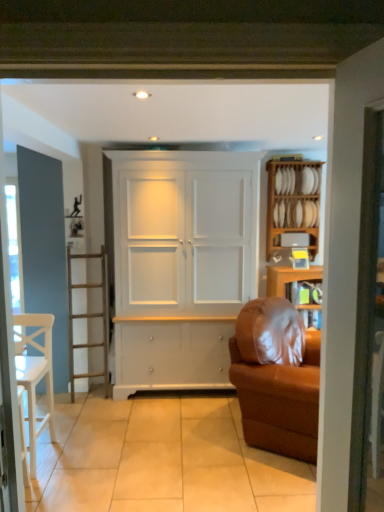
Looking at this image, in order to face white matte cabinet at center, should I rotate leftwards or rightwards?

Turn left by 0.757 degrees to look at white matte cabinet at center.

What are the coordinates of `white wooden shelf at upper right, the first shelf when ordered from bottom to top` in the screenshot? It's located at (298, 239).

What do you see at coordinates (35, 373) in the screenshot?
I see `white wood chair at left` at bounding box center [35, 373].

Where is `brown fabric couch at right`? This screenshot has height=512, width=384. brown fabric couch at right is located at coordinates (277, 378).

Identify the location of cupboard above the white wood chair at left (from a real-world perspective). Image resolution: width=384 pixels, height=512 pixels. (181, 265).

Between point (34, 378) and point (176, 365), which one is positioned in front?

The point (34, 378) is closer.

Which object is wider, white wood chair at left or white matte cabinet at center?

With larger width is white matte cabinet at center.

Could you tell me if white wood chair at left is facing white matte cabinet at center?

No, white wood chair at left is not aimed at white matte cabinet at center.

Based on their positions, is white wooden shelf at upper right, the 2th shelf from the top, located to the left or right of white matte cabinet at center?

white wooden shelf at upper right, the 2th shelf from the top, is positioned on white matte cabinet at center's right side.

Is white wooden shelf at upper right, the 2th shelf from the top, taller than white matte cabinet at center?

No.

From a real-world perspective, is white wooden shelf at upper right, the first shelf when ordered from bottom to top, over white matte cabinet at center?

Yes.

How distant is brown fabric couch at right from white matte cabinet at center?

brown fabric couch at right is 34.05 inches away from white matte cabinet at center.

Where is `cupboard above the brown fabric couch at right (from the image's perspective)`? cupboard above the brown fabric couch at right (from the image's perspective) is located at coordinates (181, 265).

Which object is positioned more to the left, brown fabric couch at right or white matte cabinet at center?

From the viewer's perspective, white matte cabinet at center appears more on the left side.

Based on the photo, choose the correct answer: Is brown fabric couch at right inside white matte cabinet at center or outside it?

brown fabric couch at right is located beyond the bounds of white matte cabinet at center.

Between brown fabric couch at right and wooden plate rack at right, which is the 1th shelf from top to bottom, which one appears on the left side from the viewer's perspective?

brown fabric couch at right is more to the left.

Does brown fabric couch at right turn towards wooden plate rack at right, which is the second shelf from bottom to top?

No, brown fabric couch at right does not turn towards wooden plate rack at right, which is the second shelf from bottom to top.

Does point (280, 435) appear closer or farther from the camera than point (308, 203)?

Point (280, 435) appears to be closer to the viewer than point (308, 203).

How different are the orientations of brown fabric couch at right and wooden plate rack at right, which is the 1th shelf from top to bottom, in degrees?

The facing directions of brown fabric couch at right and wooden plate rack at right, which is the 1th shelf from top to bottom, are 59.4 degrees apart.

Is wooden plate rack at right, which is the second shelf from bottom to top, turned away from white wooden shelf at upper right, the first shelf when ordered from bottom to top?

Yes, wooden plate rack at right, which is the second shelf from bottom to top, is facing away from white wooden shelf at upper right, the first shelf when ordered from bottom to top.

Between point (312, 240) and point (318, 241), which one is positioned in front?

The point (318, 241) is closer.

Considering the positions of objects wooden plate rack at right, which is the second shelf from bottom to top, and white wooden shelf at upper right, the first shelf when ordered from bottom to top, in the image provided, who is more to the left, wooden plate rack at right, which is the second shelf from bottom to top, or white wooden shelf at upper right, the first shelf when ordered from bottom to top,?

white wooden shelf at upper right, the first shelf when ordered from bottom to top, is more to the left.

Between wooden plate rack at right, which is the 1th shelf from top to bottom, and white wooden shelf at upper right, the 2th shelf from the top, which one has larger size?

Bigger between the two is wooden plate rack at right, which is the 1th shelf from top to bottom.

Visually, is brown fabric couch at right positioned to the left or to the right of white wood chair at left?

From the image, it's evident that brown fabric couch at right is to the right of white wood chair at left.

Considering the sizes of objects brown fabric couch at right and white wood chair at left in the image provided, who is smaller, brown fabric couch at right or white wood chair at left?

white wood chair at left is smaller.

Is brown fabric couch at right aimed at white wood chair at left?

No, brown fabric couch at right is not oriented towards white wood chair at left.

Are brown fabric couch at right and white wood chair at left located far from each other?

brown fabric couch at right is far away from white wood chair at left.

Considering the relative sizes of white matte cabinet at center and brown fabric couch at right in the image provided, is white matte cabinet at center thinner than brown fabric couch at right?

Yes, white matte cabinet at center is thinner than brown fabric couch at right.

From a real-world perspective, who is located higher, white matte cabinet at center or brown fabric couch at right?

From a 3D spatial view, white matte cabinet at center is above.

Considering the positions of objects white matte cabinet at center and brown fabric couch at right in the image provided, who is more to the right, white matte cabinet at center or brown fabric couch at right?

brown fabric couch at right is more to the right.

Consider the image. Considering the sizes of objects white matte cabinet at center and brown fabric couch at right in the image provided, who is bigger, white matte cabinet at center or brown fabric couch at right?

With larger size is white matte cabinet at center.

In order to click on cupboard above the white wood chair at left (from a real-world perspective) in this screenshot , I will do `click(181, 265)`.

You are a GUI agent. You are given a task and a screenshot of the screen. Output one action in this format:
    pyautogui.click(x=<x>, y=<y>)
    Task: Click on the cupboard that is on the left side of white wooden shelf at upper right, the 2th shelf from the top
    This screenshot has height=512, width=384.
    Given the screenshot: What is the action you would take?
    pyautogui.click(x=181, y=265)

Looking at this image, when comparing their distances from white matte cabinet at center, does white wood chair at left or brown fabric couch at right seem closer?

brown fabric couch at right is positioned closer to the anchor white matte cabinet at center.

When comparing their distances from brown fabric couch at right, does white wood chair at left or wooden plate rack at right, which is the 1th shelf from top to bottom, seem closer?

wooden plate rack at right, which is the 1th shelf from top to bottom, lies closer to brown fabric couch at right than the other object.

When comparing their distances from white wood chair at left, does brown fabric couch at right or white wooden shelf at upper right, the first shelf when ordered from bottom to top, seem closer?

Result: brown fabric couch at right.

Which object lies further to the anchor point white matte cabinet at center, brown fabric couch at right or white wooden shelf at upper right, the 2th shelf from the top?

Based on the image, white wooden shelf at upper right, the 2th shelf from the top, appears to be further to white matte cabinet at center.

Estimate the real-world distances between objects in this image. Which object is further from white wooden shelf at upper right, the first shelf when ordered from bottom to top, white wood chair at left or brown fabric couch at right?

white wood chair at left is positioned further to the anchor white wooden shelf at upper right, the first shelf when ordered from bottom to top.

Looking at the image, which one is located further to brown fabric couch at right, white wooden shelf at upper right, the first shelf when ordered from bottom to top, or white wood chair at left?

white wood chair at left is further to brown fabric couch at right.

Based on their spatial positions, is white matte cabinet at center or white wooden shelf at upper right, the first shelf when ordered from bottom to top, closer to wooden plate rack at right, which is the 1th shelf from top to bottom?

white wooden shelf at upper right, the first shelf when ordered from bottom to top, is closer to wooden plate rack at right, which is the 1th shelf from top to bottom.

From the picture: Estimate the real-world distances between objects in this image. Which object is further from white wooden shelf at upper right, the first shelf when ordered from bottom to top, white matte cabinet at center or wooden plate rack at right, which is the second shelf from bottom to top?

white matte cabinet at center lies further to white wooden shelf at upper right, the first shelf when ordered from bottom to top, than the other object.

Where is `shelf between white wood chair at left and wooden plate rack at right, which is the second shelf from bottom to top, from left to right`? This screenshot has height=512, width=384. shelf between white wood chair at left and wooden plate rack at right, which is the second shelf from bottom to top, from left to right is located at coordinates (298, 239).

What are the coordinates of `shelf between brown fabric couch at right and white wooden shelf at upper right, the first shelf when ordered from bottom to top, along the z-axis` in the screenshot? It's located at (292, 204).

The image size is (384, 512). I want to click on cupboard between white wood chair at left and wooden plate rack at right, which is the second shelf from bottom to top, from left to right, so click(181, 265).

The width and height of the screenshot is (384, 512). In order to click on cupboard located between brown fabric couch at right and white wooden shelf at upper right, the 2th shelf from the top, in the depth direction in this screenshot , I will do `click(181, 265)`.